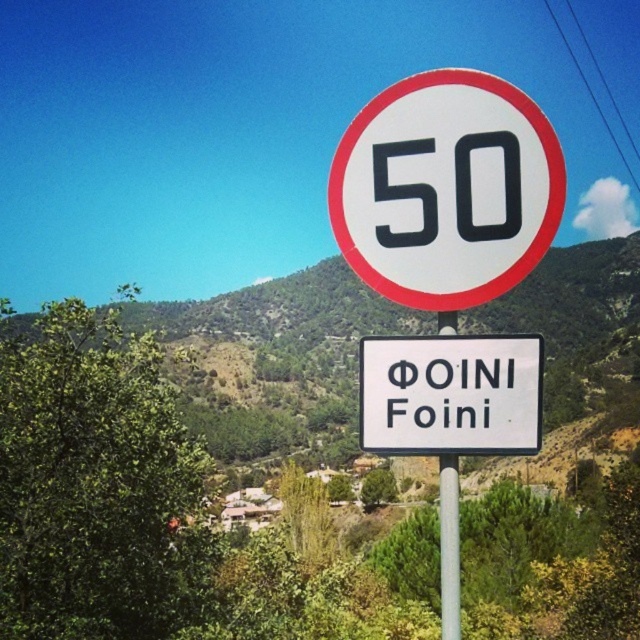
Based on the photo, can you confirm if white plastic sign at center is taller than silver metallic pole at center?

No.

This screenshot has height=640, width=640. What do you see at coordinates (451, 394) in the screenshot? I see `white plastic sign at center` at bounding box center [451, 394].

Image resolution: width=640 pixels, height=640 pixels. I want to click on white plastic sign at center, so click(451, 394).